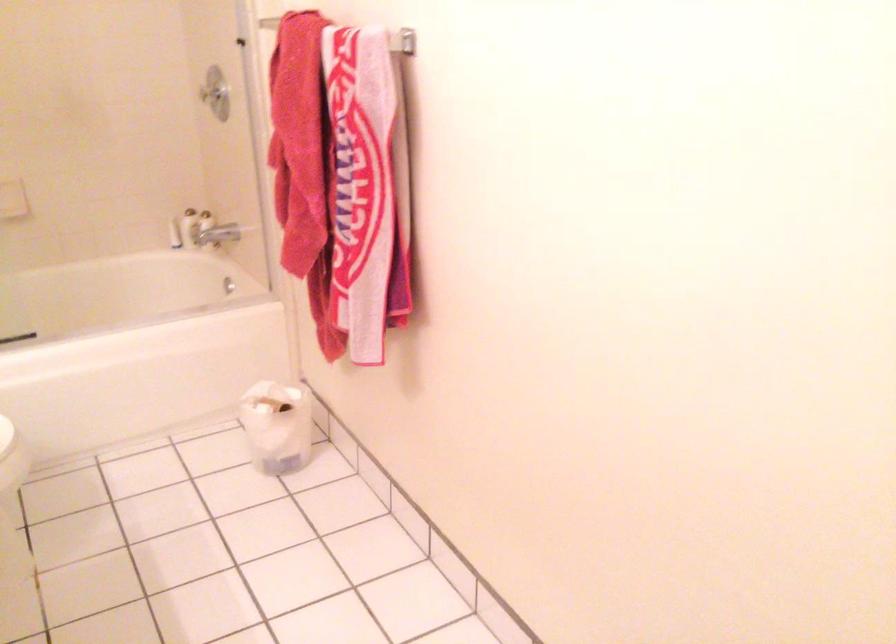
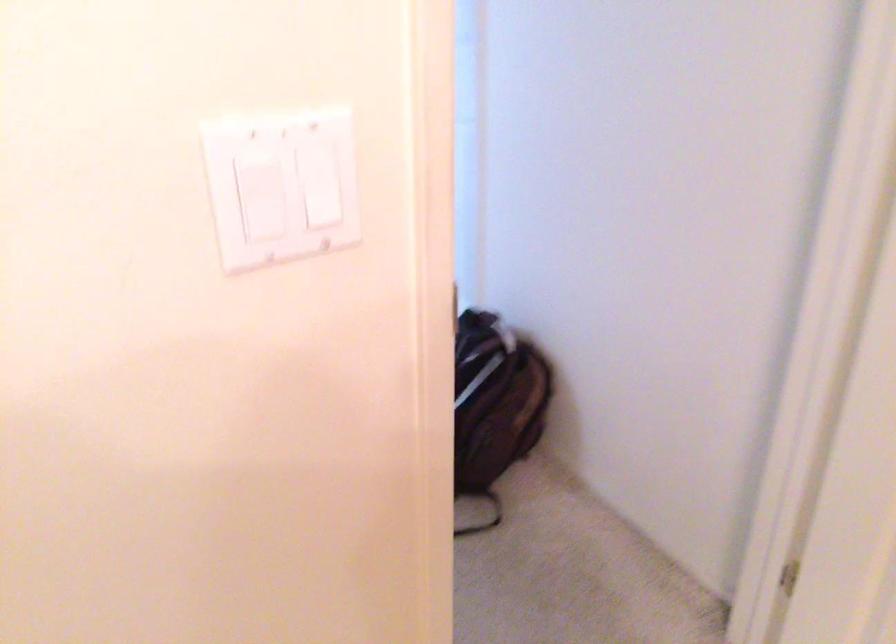
The first image is from the beginning of the video and the second image is from the end. How did the camera likely rotate when shooting the video?

The camera rotated toward right-down.